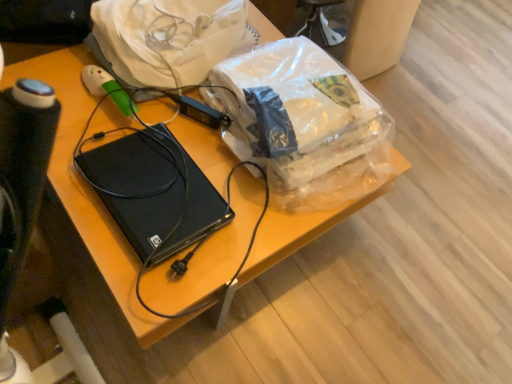
I want to click on empty space that is to the right of black plastic computer at center, so pos(249,214).